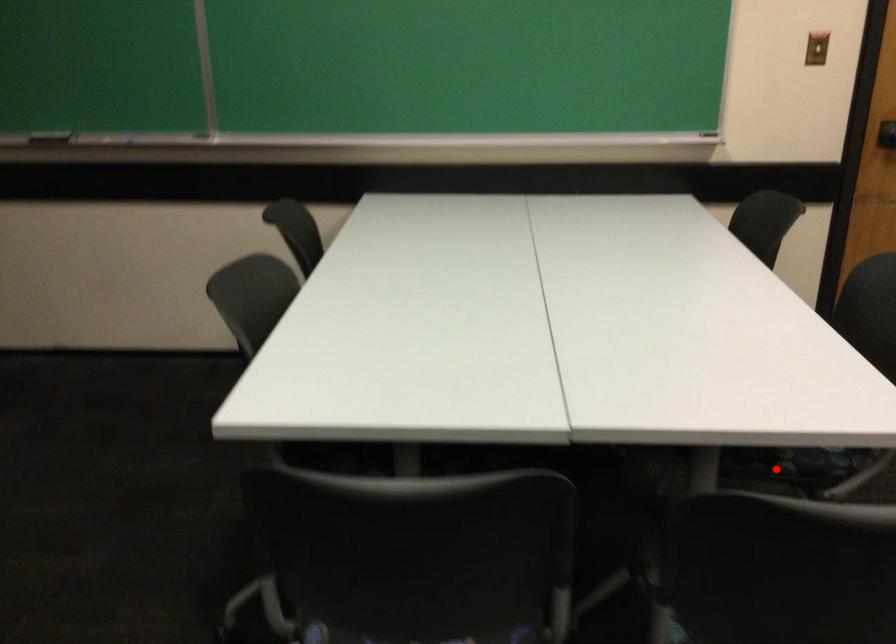
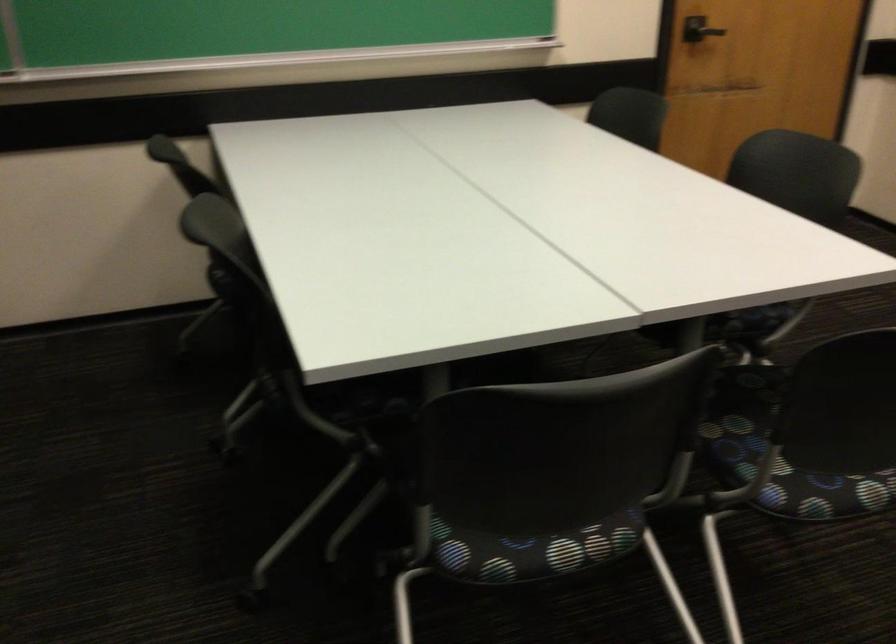
Question: I am providing you with two images of the same scene from different viewpoints. Image1 has a red point marked. In image2, the corresponding 3D location appears at what relative position? Reply with the corresponding letter.

Choices:
 (A) Closer
 (B) Farther

Answer: (B)